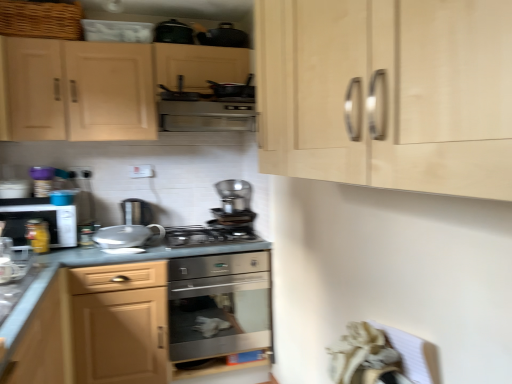
The height and width of the screenshot is (384, 512). Describe the element at coordinates (205, 116) in the screenshot. I see `satin silver vent at center` at that location.

Find the location of `yellow glass jar at left, positioned as the 2th appliance in bottom-to-top order`. yellow glass jar at left, positioned as the 2th appliance in bottom-to-top order is located at coordinates (38, 235).

What do you see at coordinates (45, 340) in the screenshot? I see `matte wood drawer at lower left, positioned as the 3th cabinetry in top-to-bottom order` at bounding box center [45, 340].

At what (x,y) coordinates should I click in order to perform the action: click on satin silver kettle at center, which is the fourth appliance in right-to-left order. Please return your answer as a coordinate pair (x, y). Looking at the image, I should click on (136, 212).

Looking at this image, which of these two, matte white microwave at left, which appears as the 6th appliance when ordered from the bottom, or stainless steel oven at center, is thinner?

With smaller width is matte white microwave at left, which appears as the 6th appliance when ordered from the bottom.

Who is bigger, matte white microwave at left, marked as the 7th appliance in a right-to-left arrangement, or stainless steel oven at center?

stainless steel oven at center is bigger.

Considering the positions of objects matte white microwave at left, marked as the 7th appliance in a right-to-left arrangement, and stainless steel oven at center in the image provided, who is more to the right, matte white microwave at left, marked as the 7th appliance in a right-to-left arrangement, or stainless steel oven at center?

Positioned to the right is stainless steel oven at center.

Is the surface of matte white microwave at left, marked as the 1th appliance in a left-to-right arrangement, in direct contact with stainless steel oven at center?

No, matte white microwave at left, marked as the 1th appliance in a left-to-right arrangement, is not beside stainless steel oven at center.

Is point (210, 223) more distant than point (22, 179)?

Yes, it is behind point (22, 179).

The height and width of the screenshot is (384, 512). I want to click on appliance that is the 1st one when counting upward from the satin silver coffee maker at center, the 6th appliance in the left-to-right sequence (from the image's perspective), so pyautogui.click(x=15, y=188).

Does satin silver coffee maker at center, positioned as the second appliance in right-to-left order, have a larger size compared to matte white microwave at left, which appears as the 6th appliance when ordered from the bottom?

Yes, satin silver coffee maker at center, positioned as the second appliance in right-to-left order, is bigger than matte white microwave at left, which appears as the 6th appliance when ordered from the bottom.

Is satin silver coffee maker at center, the 6th appliance in the left-to-right sequence, oriented towards matte white microwave at left, marked as the 1th appliance in a left-to-right arrangement?

No, satin silver coffee maker at center, the 6th appliance in the left-to-right sequence, is not turned towards matte white microwave at left, marked as the 1th appliance in a left-to-right arrangement.

In the scene shown: Which is closer to the camera, (345, 159) or (62, 382)?

The point (345, 159) is closer to the camera.

How many degrees apart are the facing directions of light wood cabinet at upper right, the 2th cabinetry in the top-to-bottom sequence, and matte wood drawer at lower left, positioned as the 3th cabinetry in top-to-bottom order?

The angular difference between light wood cabinet at upper right, the 2th cabinetry in the top-to-bottom sequence, and matte wood drawer at lower left, positioned as the 3th cabinetry in top-to-bottom order, is 179 degrees.

From a real-world perspective, relative to matte wood drawer at lower left, positioned as the 3th cabinetry in top-to-bottom order, is light wood cabinet at upper right, acting as the 3th cabinetry starting from the bottom, vertically above or below?

From a real-world perspective, light wood cabinet at upper right, acting as the 3th cabinetry starting from the bottom, is physically above matte wood drawer at lower left, positioned as the 3th cabinetry in top-to-bottom order.

Can you confirm if light wood cabinet at upper right, acting as the 3th cabinetry starting from the bottom, is wider than matte wood drawer at lower left, the second cabinetry ordered from the bottom?

Indeed, light wood cabinet at upper right, acting as the 3th cabinetry starting from the bottom, has a greater width compared to matte wood drawer at lower left, the second cabinetry ordered from the bottom.

From a real-world perspective, who is located lower, stainless steel gas stove at center or matte black microwave at left?

stainless steel gas stove at center.

From the image's perspective, which is above, stainless steel gas stove at center or matte black microwave at left?

matte black microwave at left is shown above in the image.

Which object is positioned more to the left, stainless steel gas stove at center or matte black microwave at left?

matte black microwave at left.

Is point (20, 185) closer or farther from the camera than point (40, 227)?

Point (20, 185).

Is matte white microwave at left, marked as the 1th appliance in a left-to-right arrangement, oriented away from yellow glass jar at left, the sixth appliance viewed from the top?

No, matte white microwave at left, marked as the 1th appliance in a left-to-right arrangement, is not facing the opposite direction of yellow glass jar at left, the sixth appliance viewed from the top.

Is matte white microwave at left, marked as the 1th appliance in a left-to-right arrangement, not close to yellow glass jar at left, which ranks as the 6th appliance in right-to-left order?

That's not correct — matte white microwave at left, marked as the 1th appliance in a left-to-right arrangement, is a little close to yellow glass jar at left, which ranks as the 6th appliance in right-to-left order.

Based on their sizes in the image, would you say metallic silver frying pan at upper center, which is counted as the first appliance, starting from the top, is bigger or smaller than satin wood cabinet at lower center, the first cabinetry when ordered from bottom to top?

Clearly, metallic silver frying pan at upper center, which is counted as the first appliance, starting from the top, is smaller in size than satin wood cabinet at lower center, the first cabinetry when ordered from bottom to top.

Considering the sizes of objects metallic silver frying pan at upper center, the 7th appliance ordered from the bottom, and satin wood cabinet at lower center, which ranks as the fourth cabinetry in top-to-bottom order, in the image provided, who is taller, metallic silver frying pan at upper center, the 7th appliance ordered from the bottom, or satin wood cabinet at lower center, which ranks as the fourth cabinetry in top-to-bottom order,?

satin wood cabinet at lower center, which ranks as the fourth cabinetry in top-to-bottom order, is taller.

From the image's perspective, which one is positioned lower, metallic silver frying pan at upper center, which is the 1th appliance from right to left, or satin wood cabinet at lower center, which ranks as the fourth cabinetry in top-to-bottom order?

satin wood cabinet at lower center, which ranks as the fourth cabinetry in top-to-bottom order, is shown below in the image.

Does point (220, 87) appear closer or farther from the camera than point (40, 300)?

Point (220, 87) appears to be farther away from the viewer than point (40, 300).

Who is smaller, matte white microwave at left, which appears as the 6th appliance when ordered from the bottom, or woven wicker basket at upper left?

With smaller size is matte white microwave at left, which appears as the 6th appliance when ordered from the bottom.

From the image's perspective, would you say matte white microwave at left, marked as the 1th appliance in a left-to-right arrangement, is positioned over woven wicker basket at upper left?

No, from the image's perspective, matte white microwave at left, marked as the 1th appliance in a left-to-right arrangement, is not over woven wicker basket at upper left.

Which object is positioned more to the left, matte white microwave at left, which appears as the 6th appliance when ordered from the bottom, or woven wicker basket at upper left?

From the viewer's perspective, matte white microwave at left, which appears as the 6th appliance when ordered from the bottom, appears more on the left side.

Measure the distance between matte white microwave at left, marked as the 7th appliance in a right-to-left arrangement, and woven wicker basket at upper left.

matte white microwave at left, marked as the 7th appliance in a right-to-left arrangement, and woven wicker basket at upper left are 36.21 inches apart from each other.

Where is `the 5th appliance counting from the left of the stainless steel oven at center`? the 5th appliance counting from the left of the stainless steel oven at center is located at coordinates (15, 188).

From the satin silver coffee maker at center, the 6th appliance in the left-to-right sequence, count 2nd appliances forward and point to it. Please provide its 2D coordinates.

[(15, 188)]

Estimate the real-world distances between objects in this image. Which object is further from satin silver coffee maker at center, positioned as the second appliance in right-to-left order, light wood cabinet at upper left, which appears as the first cabinetry when viewed from the top, or stainless steel gas stove at center?

Based on the image, light wood cabinet at upper left, which appears as the first cabinetry when viewed from the top, appears to be further to satin silver coffee maker at center, positioned as the second appliance in right-to-left order.

Looking at the image, which one is located further to satin silver coffee maker at center, the fifth appliance positioned from the bottom, yellow glass jar at left, positioned as the 2th appliance in bottom-to-top order, or stainless steel oven at center?

yellow glass jar at left, positioned as the 2th appliance in bottom-to-top order.

Based on their spatial positions, is matte white microwave at left, marked as the 2th appliance in a top-to-bottom arrangement, or satin silver kettle at center, acting as the fifth appliance starting from the top, closer to stainless steel gas stove at center?

satin silver kettle at center, acting as the fifth appliance starting from the top.

From the image, which object appears to be nearer to matte white microwave at left, marked as the 7th appliance in a right-to-left arrangement, satin wood cabinet at lower center, the first cabinetry when ordered from bottom to top, or satin silver kettle at center, acting as the fifth appliance starting from the top?

Based on the image, satin silver kettle at center, acting as the fifth appliance starting from the top, appears to be nearer to matte white microwave at left, marked as the 7th appliance in a right-to-left arrangement.

Estimate the real-world distances between objects in this image. Which object is further from matte black microwave at left, stainless steel gas stove at center or matte white microwave at left, marked as the 2th appliance in a top-to-bottom arrangement?

stainless steel gas stove at center.

From the image, which object appears to be farther from white glossy kettle at center, the fifth appliance positioned from the left, matte white microwave at left, marked as the 2th appliance in a top-to-bottom arrangement, or stainless steel oven at center?

matte white microwave at left, marked as the 2th appliance in a top-to-bottom arrangement.

Which object lies further to the anchor point matte black microwave at left, stainless steel gas stove at center or light wood cabinet at upper right, acting as the 3th cabinetry starting from the bottom?

light wood cabinet at upper right, acting as the 3th cabinetry starting from the bottom, is further to matte black microwave at left.

When comparing their distances from light wood cabinet at upper left, which appears as the first cabinetry when viewed from the top, does satin silver kettle at center, which is the fourth appliance in right-to-left order, or yellow glass jar at left, which ranks as the 6th appliance in right-to-left order, seem closer?

satin silver kettle at center, which is the fourth appliance in right-to-left order.

What are the coordinates of `basket between light wood cabinet at upper right, the 2th cabinetry in the top-to-bottom sequence, and matte black microwave at left in the front-back direction` in the screenshot? It's located at (41, 19).

I want to click on kitchen appliance between light wood cabinet at upper right, the 2th cabinetry in the top-to-bottom sequence, and stainless steel oven at center from front to back, so click(42, 219).

Where is `kitchen appliance located between matte white microwave at left, marked as the 7th appliance in a right-to-left arrangement, and satin silver kettle at center, acting as the fourth appliance starting from the left, in the left-right direction`? Image resolution: width=512 pixels, height=384 pixels. kitchen appliance located between matte white microwave at left, marked as the 7th appliance in a right-to-left arrangement, and satin silver kettle at center, acting as the fourth appliance starting from the left, in the left-right direction is located at coordinates (42, 219).

The width and height of the screenshot is (512, 384). Identify the location of gas stove between blue plastic container at left, which is the 3th appliance from left to right, and metallic silver frying pan at upper center, the 7th appliance viewed from the left, from left to right. (206, 235).